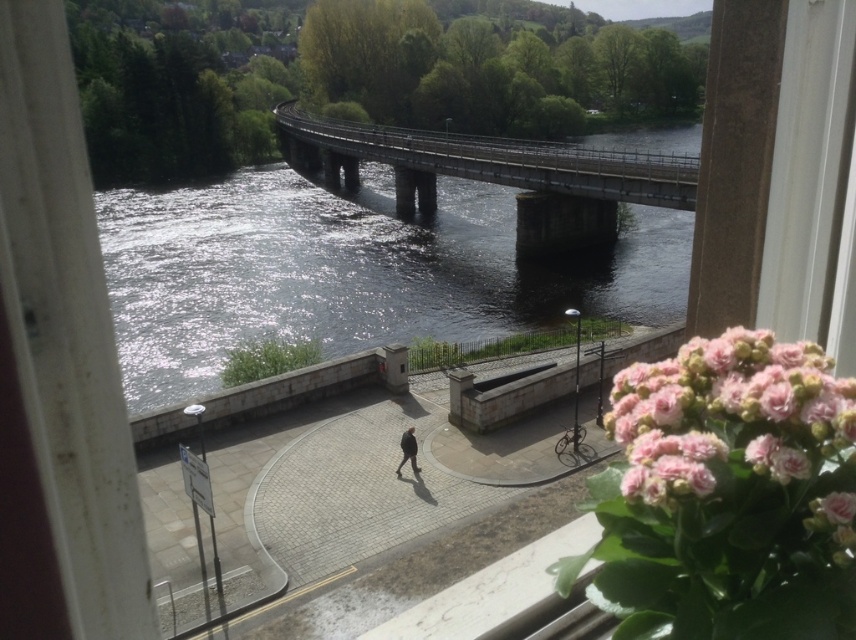
You are standing at the center of the bridge and see a point marked at coordinates point (736,436). According to the scene, where is this point located?

The point (736,436) is located on pink fluffy flowers at lower right.

You are an artist planning to paint the riverside scene through the window. You want to ensure the pink fluffy flowers at lower right and the black matte jacket at center are both visible in your painting. Which object should you allocate more canvas space to?

The black matte jacket at center requires more canvas space because it occupies more space than the pink fluffy flowers at lower right.

You are standing at the riverside and looking through the window. You see the pink fluffy flowers at lower right and the black matte jacket at center. Which object is higher in the image?

The pink fluffy flowers at lower right is above the black matte jacket at center, so the pink fluffy flowers at lower right is higher in the image.